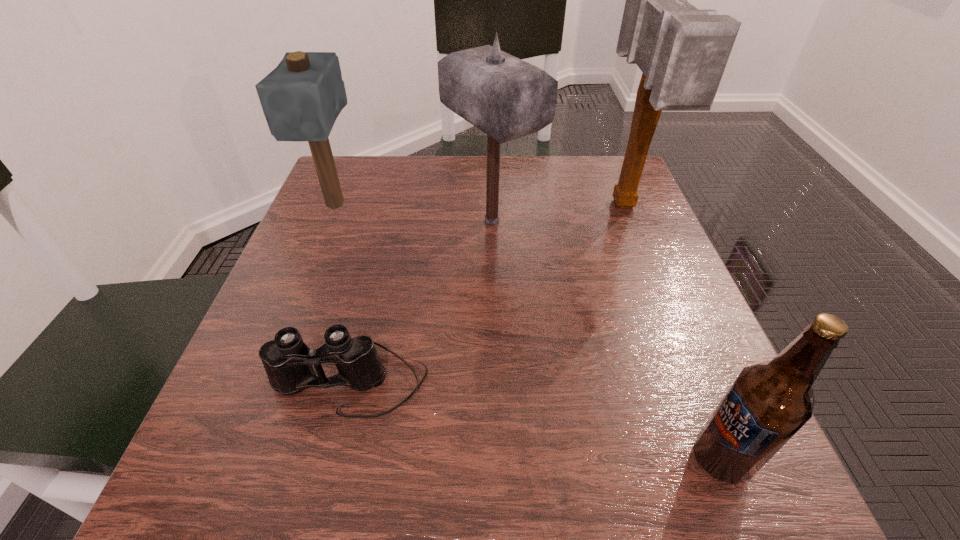
This screenshot has width=960, height=540. I want to click on object that is at the far right corner, so click(x=682, y=51).

The width and height of the screenshot is (960, 540). Identify the location of object present at the near right corner. (767, 404).

This screenshot has width=960, height=540. I want to click on blank space at the far edge of the desktop, so click(524, 174).

In the image, there is a desktop. Identify the location of free space at the near edge. The image size is (960, 540). tap(344, 473).

Find the location of a particular element. Image resolution: width=960 pixels, height=540 pixels. free space at the left edge of the desktop is located at coordinates (375, 238).

In the image, there is a desktop. Where is `free space at the right edge`? free space at the right edge is located at coordinates (603, 309).

This screenshot has height=540, width=960. Find the location of `vacant region at the far left corner of the desktop`. vacant region at the far left corner of the desktop is located at coordinates [368, 181].

Where is `free space at the far right corner of the desktop`? free space at the far right corner of the desktop is located at coordinates (584, 201).

Find the location of a particular element. This screenshot has height=540, width=960. vacant space at the near right corner is located at coordinates (693, 512).

The width and height of the screenshot is (960, 540). I want to click on vacant region between the second mallet from left to right and the shortest object, so click(420, 301).